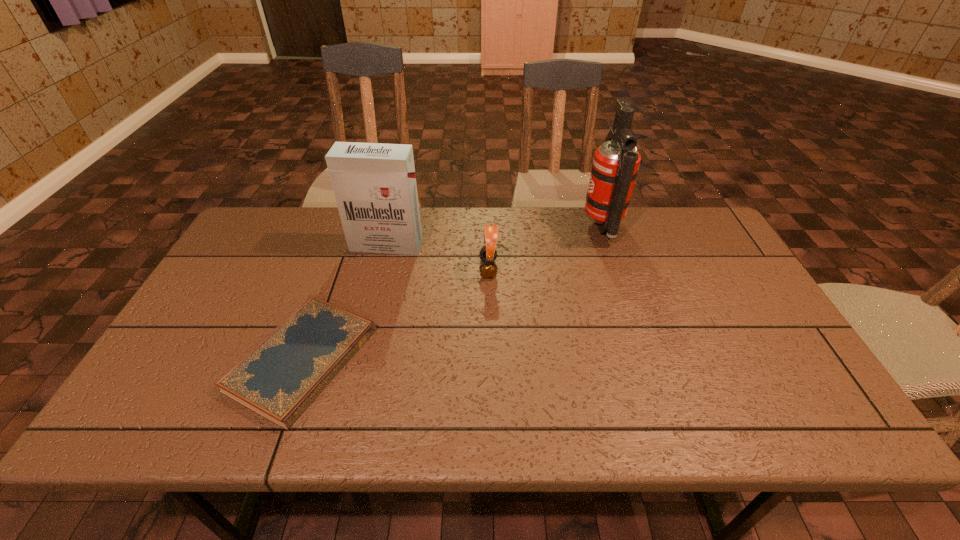
Find the location of `vacant space situated 0.100m on the right of the cigarette case`. vacant space situated 0.100m on the right of the cigarette case is located at coordinates (453, 245).

This screenshot has width=960, height=540. Identify the location of free spot located 0.270m on the ear cups of the second nearest object. (387, 269).

At what (x,y) coordinates should I click in order to perform the action: click on vacant space located on the ear cups of the second nearest object. Please return your answer as a coordinate pair (x, y). This screenshot has height=540, width=960. Looking at the image, I should click on (391, 269).

Where is `vacant space located on the ear cups of the second nearest object`? This screenshot has height=540, width=960. vacant space located on the ear cups of the second nearest object is located at coordinates (370, 269).

Identify the location of free space located on the right of the paperback book. (429, 359).

You are a GUI agent. You are given a task and a screenshot of the screen. Output one action in this format:
    pyautogui.click(x=<x>, y=<y>)
    Task: Click on the fire extinguisher at the far edge
    
    Given the screenshot: What is the action you would take?
    pyautogui.click(x=615, y=165)

Find the location of a particular element. The image size is (960, 540). cigarette case present at the far edge is located at coordinates (374, 184).

Locate an element on the screen. This screenshot has height=540, width=960. object located in the near edge section of the desktop is located at coordinates (282, 375).

Find the location of a particular element. free location at the far edge of the desktop is located at coordinates (320, 217).

At what (x,y) coordinates should I click in order to perform the action: click on vacant region at the near edge of the desktop. Please return your answer as a coordinate pair (x, y). Looking at the image, I should click on (459, 430).